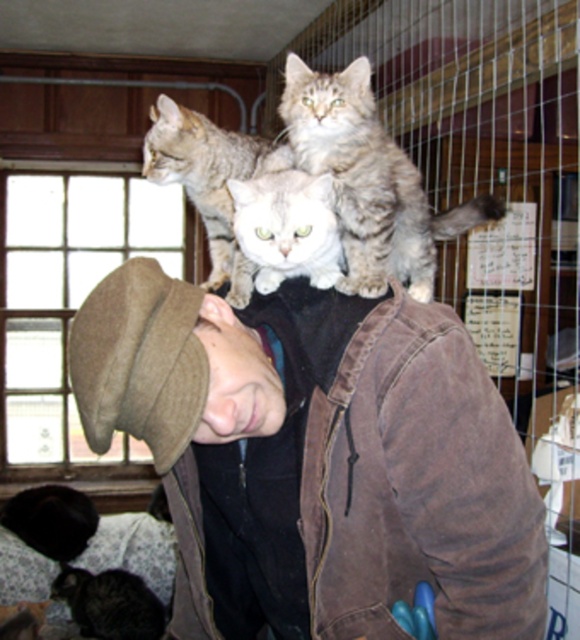
Question: Which point is closer to the camera?

Choices:
 (A) tabby fur cat at center
 (B) brown suede jacket at center
 (C) black fur head at lower left

Answer: (B)

Question: Which object appears closest to the camera in this image?

Choices:
 (A) black fur head at lower left
 (B) brown suede jacket at center

Answer: (B)

Question: Considering the relative positions of brown suede jacket at center and tabby fur cat at center in the image provided, where is brown suede jacket at center located with respect to tabby fur cat at center?

Choices:
 (A) above
 (B) below

Answer: (B)

Question: Is brown suede jacket at center bigger than tabby fur cat at center?

Choices:
 (A) yes
 (B) no

Answer: (A)

Question: Which object appears closest to the camera in this image?

Choices:
 (A) brown suede jacket at center
 (B) black fur head at lower left

Answer: (A)

Question: Is brown suede jacket at center to the right of black fur head at lower left from the viewer's perspective?

Choices:
 (A) yes
 (B) no

Answer: (A)